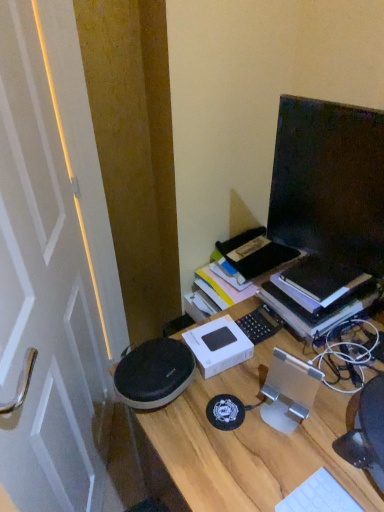
You are a GUI agent. You are given a task and a screenshot of the screen. Output one action in this format:
    pyautogui.click(x=<x>, y=<y>)
    Task: Click on the blank space above hardcover book at right (from a real-world perspective)
    The width and height of the screenshot is (384, 512).
    Given the screenshot: What is the action you would take?
    pyautogui.click(x=327, y=279)